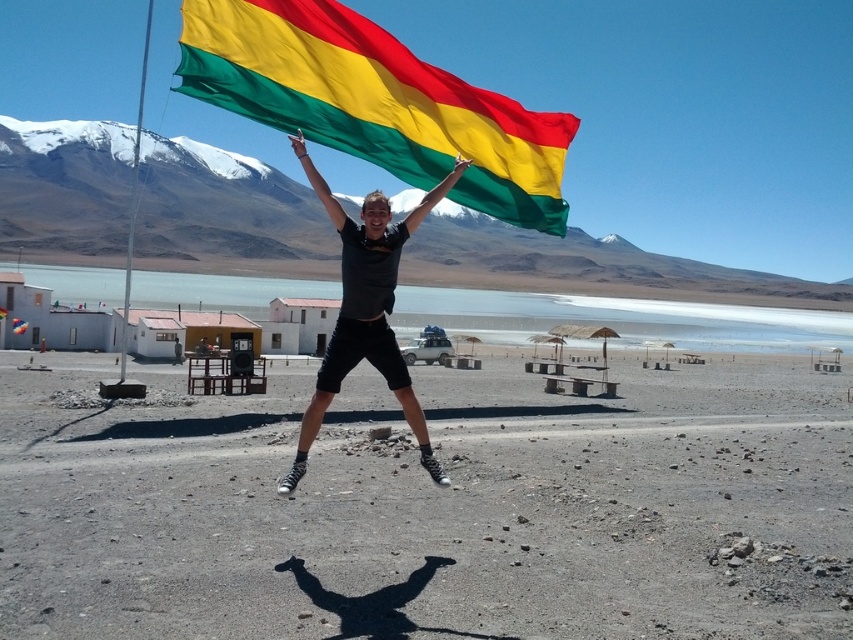
Question: Does yellow-green-red fabric flag at upper center appear under yellow-green fabric flag at upper center?

Choices:
 (A) no
 (B) yes

Answer: (A)

Question: Among these points, which one is nearest to the camera?

Choices:
 (A) (22, 323)
 (B) (236, 51)
 (C) (316, 417)

Answer: (C)

Question: Which point is closer to the camera?

Choices:
 (A) yellow-green-red fabric flag at upper center
 (B) matte black shorts at center
 (C) yellow-green fabric flag at upper center

Answer: (B)

Question: Does yellow-green-red fabric flag at upper center appear over matte black shorts at center?

Choices:
 (A) yes
 (B) no

Answer: (A)

Question: Based on their relative distances, which object is nearer to the yellow-green-red fabric flag at upper center?

Choices:
 (A) yellow-green fabric flag at upper center
 (B) matte black shorts at center

Answer: (B)

Question: Does yellow-green-red fabric flag at upper center appear over yellow-green fabric flag at upper center?

Choices:
 (A) no
 (B) yes

Answer: (B)